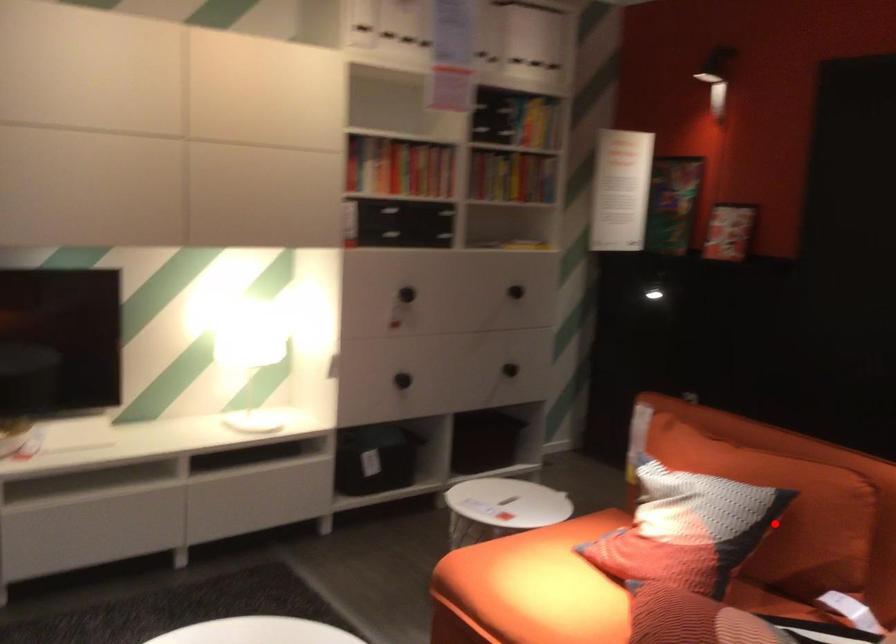
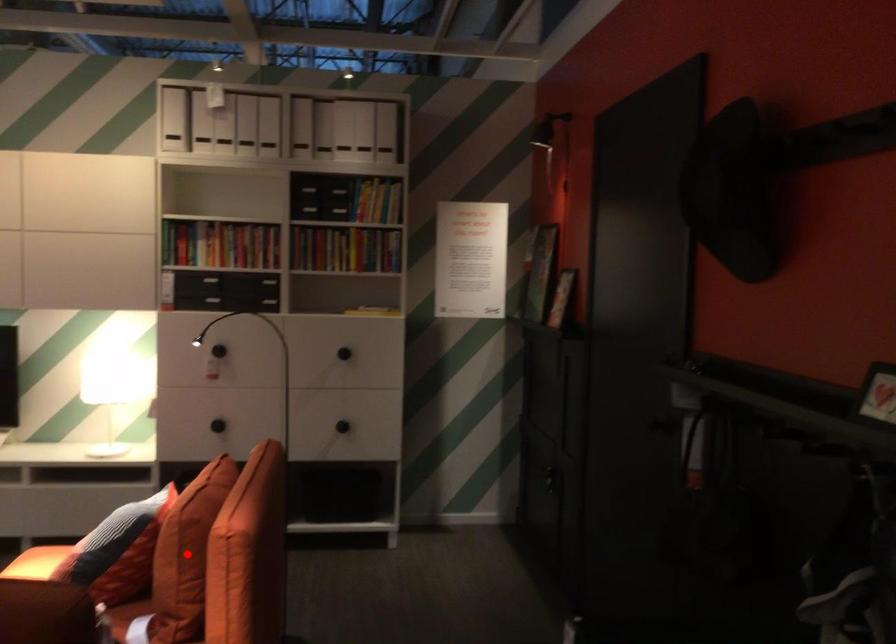
I am providing you with two images of the same scene from different viewpoints. A red point is marked on the first image and another point is marked on the second image. Are the points marked in image1 and image2 representing the same 3D position?

No